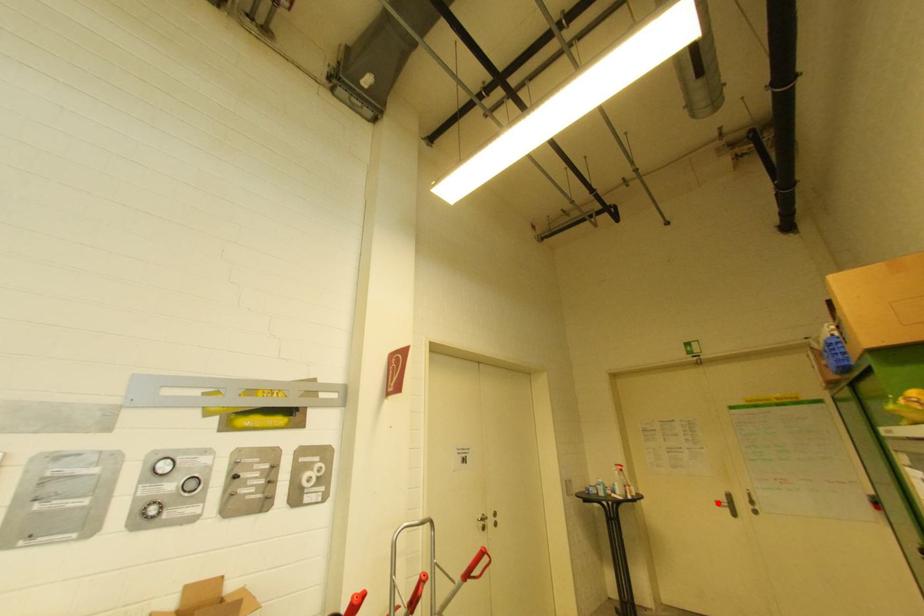
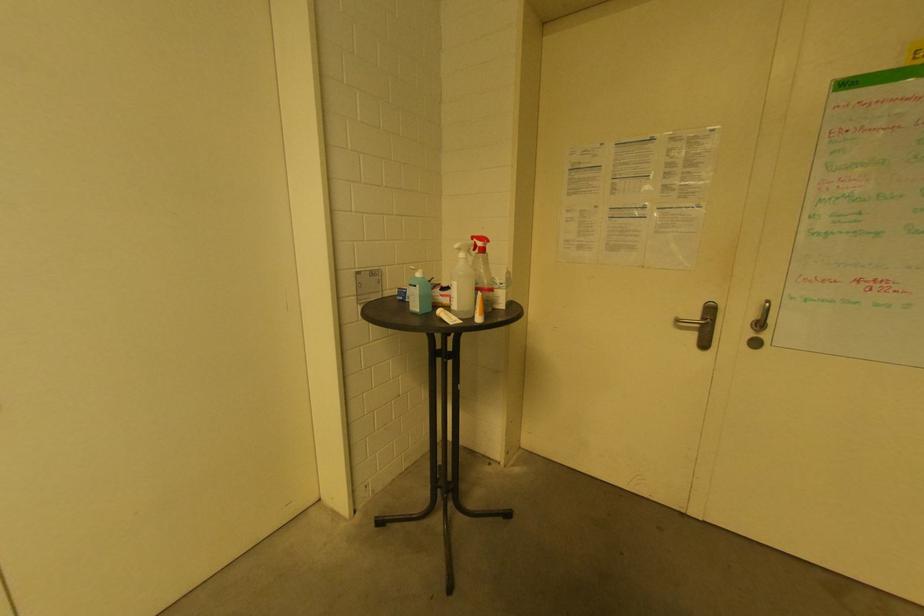
Locate, in the second image, the point that corresponds to the highlighted location in the first image.

(681, 323)